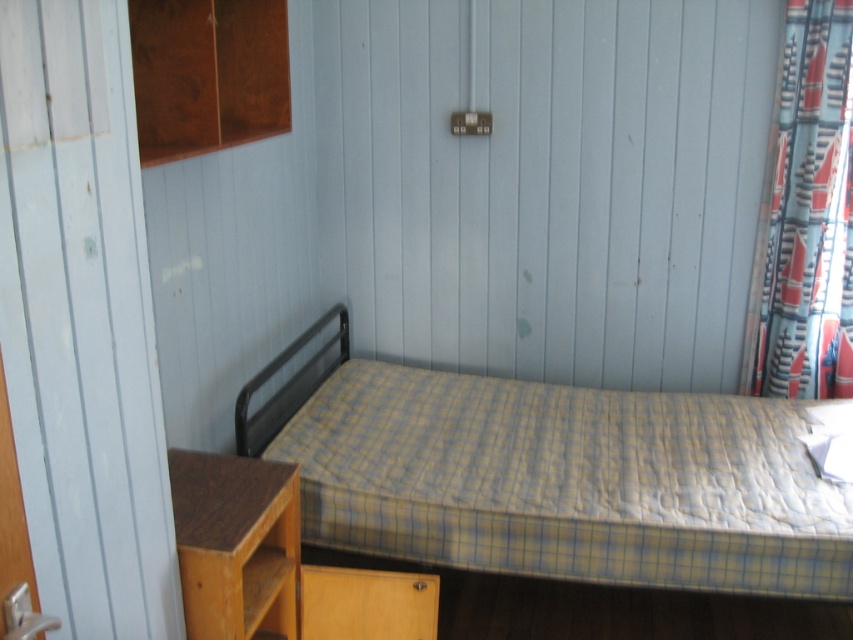
Is point (817, 500) positioned behind point (144, 24)?

That is True.

Can you confirm if yellow checkered mattress at center is thinner than wooden cabinet at upper left?

Incorrect, yellow checkered mattress at center's width is not less than wooden cabinet at upper left's.

Is point (577, 518) farther from viewer compared to point (245, 19)?

That is False.

The width and height of the screenshot is (853, 640). In order to click on yellow checkered mattress at center in this screenshot , I will do `click(549, 476)`.

Can you confirm if patterned fabric curtain at right is shorter than wooden cabinet at upper left?

No.

Who is more forward, [822,138] or [231,88]?

Positioned in front is point [231,88].

Who is more distant from viewer, (770, 328) or (166, 13)?

Positioned behind is point (770, 328).

I want to click on patterned fabric curtain at right, so click(798, 198).

Between yellow checkered mattress at center and patterned fabric curtain at right, which one is positioned higher?

Positioned higher is patterned fabric curtain at right.

Which is below, yellow checkered mattress at center or patterned fabric curtain at right?

yellow checkered mattress at center is lower down.

Measure the distance between point [734,444] and camera.

Point [734,444] is 2.60 meters away from camera.

I want to click on yellow checkered mattress at center, so click(549, 476).